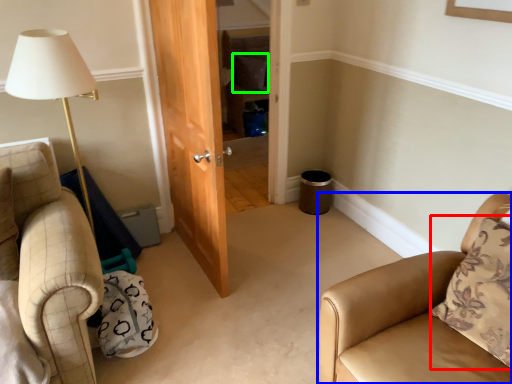
Question: Which object is positioned closest to pillow (highlighted by a red box)? Select from chair (highlighted by a blue box) and pillow (highlighted by a green box).

Choices:
 (A) chair
 (B) pillow

Answer: (A)